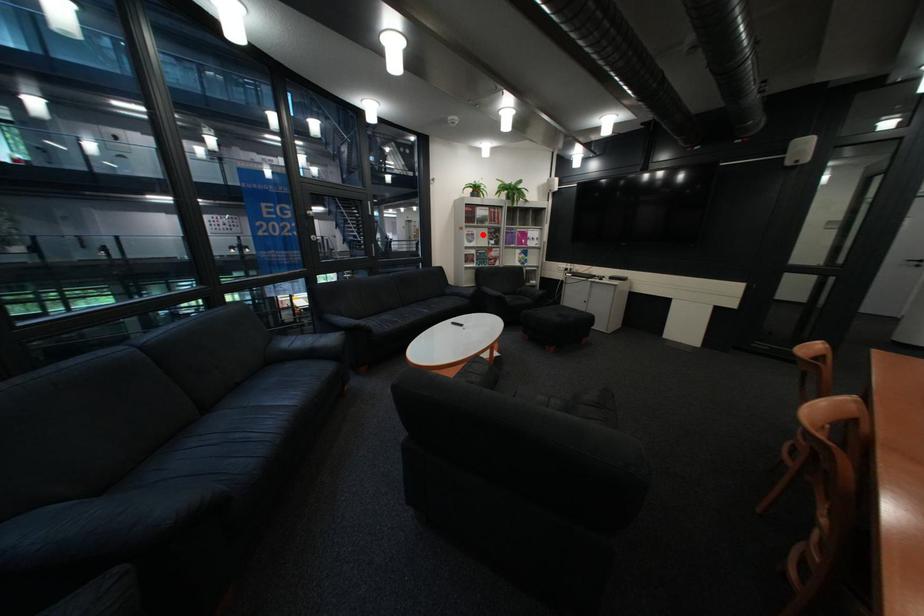
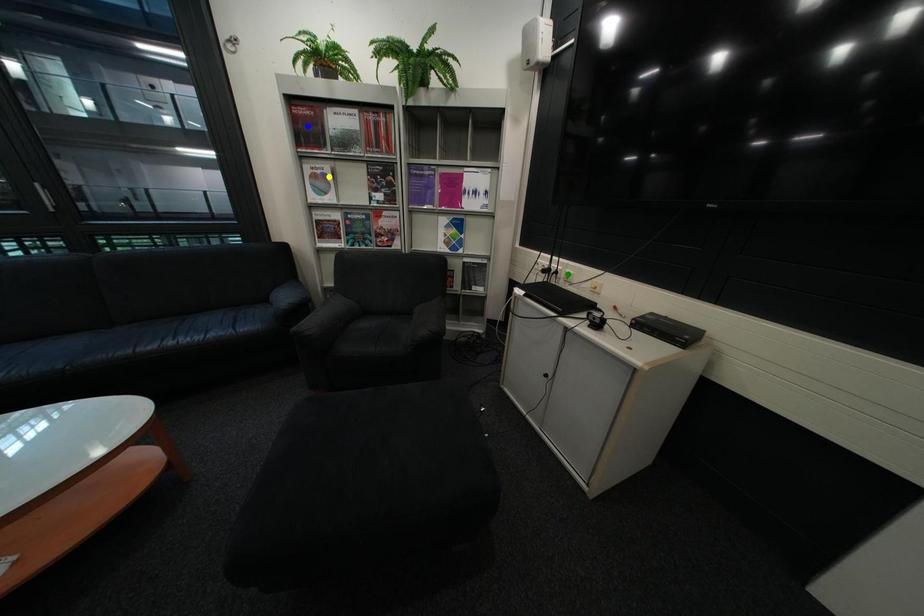
Question: I am providing you with two images of the same scene from different viewpoints. A red point is marked on the first image. You are given multiple points on the second image. Can you choose the point in image 2 that corresponds to the point in image 1?

Choices:
 (A) green point
 (B) blue point
 (C) yellow point

Answer: (C)